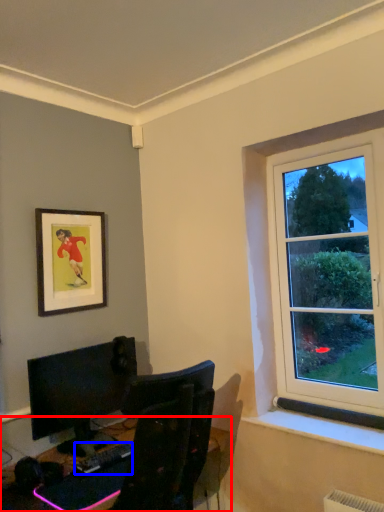
Question: Which point is further to the camera, desk (highlighted by a red box) or computer keyboard (highlighted by a blue box)?

Choices:
 (A) desk
 (B) computer keyboard

Answer: (B)